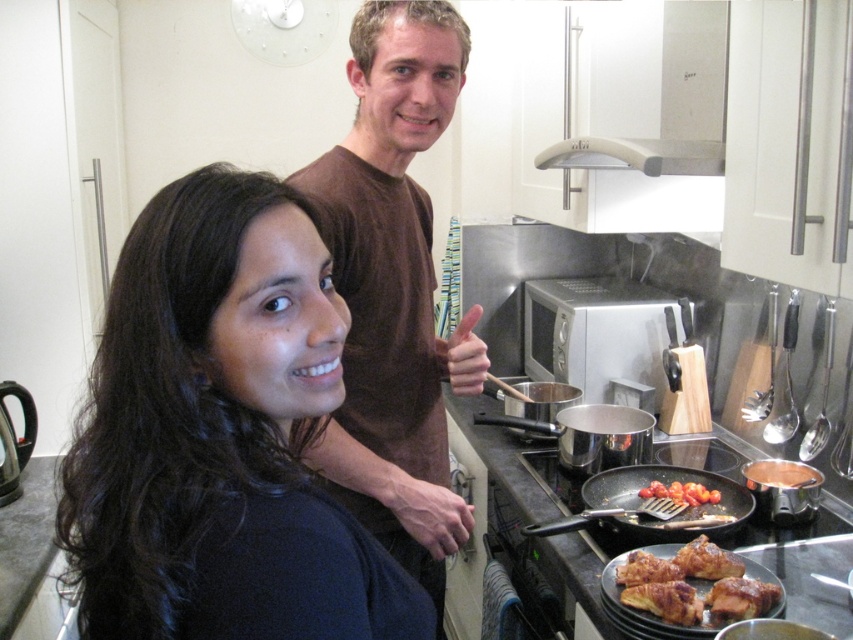
You are a chef who needs to place the golden crispy pastry at lower right under the white glossy exhaust hood at upper center. Based on their sizes, will the pastry fit underneath the hood?

The white glossy exhaust hood at upper center is larger in size than the golden crispy pastry at lower right, so the pastry should fit underneath the hood since the hood is bigger.

What are the coordinates of the black matte hair at upper left?

The black matte hair at upper left is located at coordinates point (216, 442).

In the kitchen scene, there is a white glossy exhaust hood at upper center and a golden crispy pastry at lower right. From the perspective of someone standing at the stove, which object is positioned to the left?

The white glossy exhaust hood at upper center is to the left of the golden crispy pastry at lower right, so from the stove, the white glossy exhaust hood at upper center is on the left side.